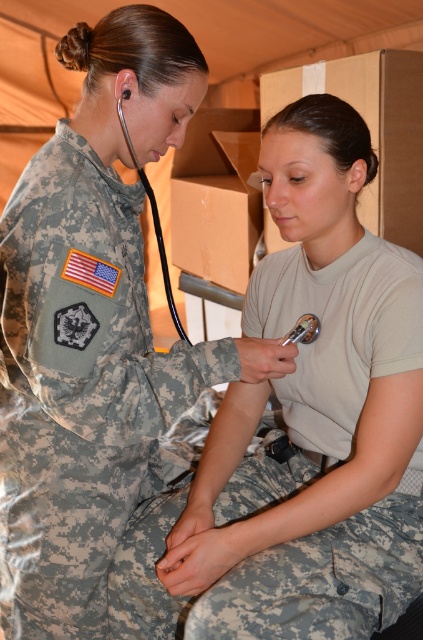
You are a medical professional in a field hospital. You need to reach a medical kit located at point (2, 387). If you are currently 1.5 meters away from the kit, can you reach it without moving your position?

The distance of point (2, 387) from camera is 1.13 meters. Since you are currently 1.5 meters away from the kit, you cannot reach it without moving closer.